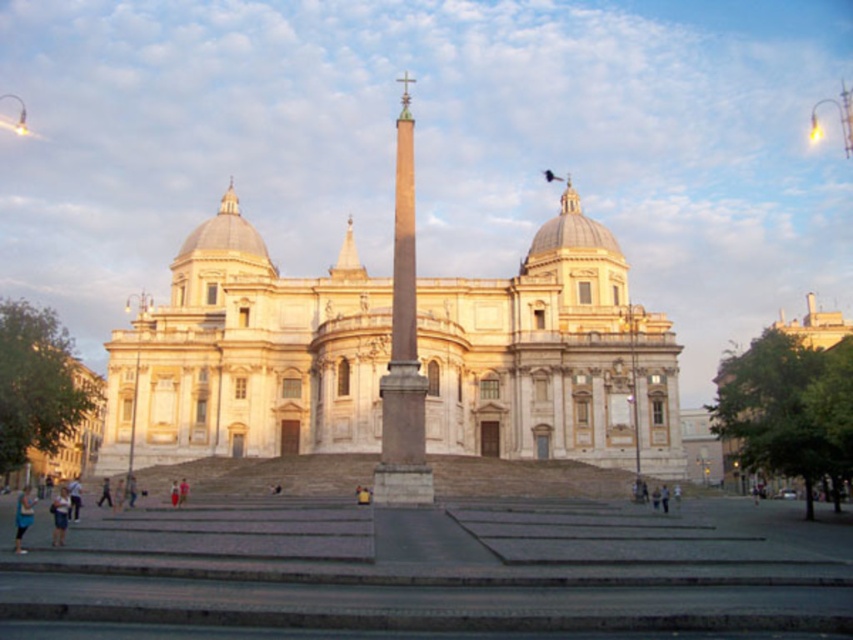
You are standing in front of a grand classical building with two domes. You see a smooth stone obelisk at center and skinny jeans at lower left. Which object is positioned to the right of the other?

The smooth stone obelisk at center is to the right of the skinny jeans at lower left.

You are standing in front of the grand classical building and want to locate two points marked on the structure. The first point is at coordinates point (x=384, y=472) and the second is at point (x=15, y=548). Which of these points is closer to you?

Point (x=384, y=472) is closer to you because it is further to the viewer than point (x=15, y=548).

From the picture: You are a visitor standing in front of the grand classical building. You notice the smooth stone obelisk at center and the blue denim jeans at lower left. Which object is taller?

The smooth stone obelisk at center is taller than the blue denim jeans at lower left.